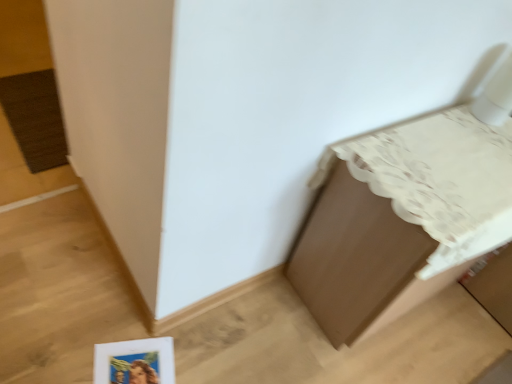
Identify the location of brown matte cabinet at upper right. Image resolution: width=512 pixels, height=384 pixels. (401, 219).

The width and height of the screenshot is (512, 384). What do you see at coordinates (401, 219) in the screenshot?
I see `brown matte cabinet at upper right` at bounding box center [401, 219].

This screenshot has width=512, height=384. I want to click on brown matte cabinet at upper right, so click(x=401, y=219).